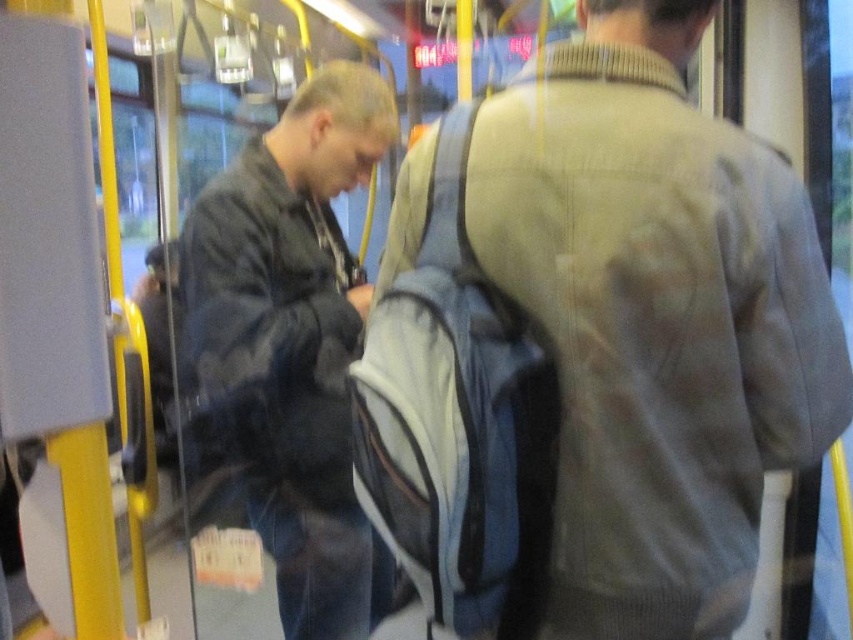
The image size is (853, 640). I want to click on black matte jacket at left, so click(x=288, y=346).

Can you confirm if black matte jacket at left is shorter than gray wool sweater at center?

No.

You are a GUI agent. You are given a task and a screenshot of the screen. Output one action in this format:
    pyautogui.click(x=<x>, y=<y>)
    Task: Click on the black matte jacket at left
    
    Given the screenshot: What is the action you would take?
    pyautogui.click(x=288, y=346)